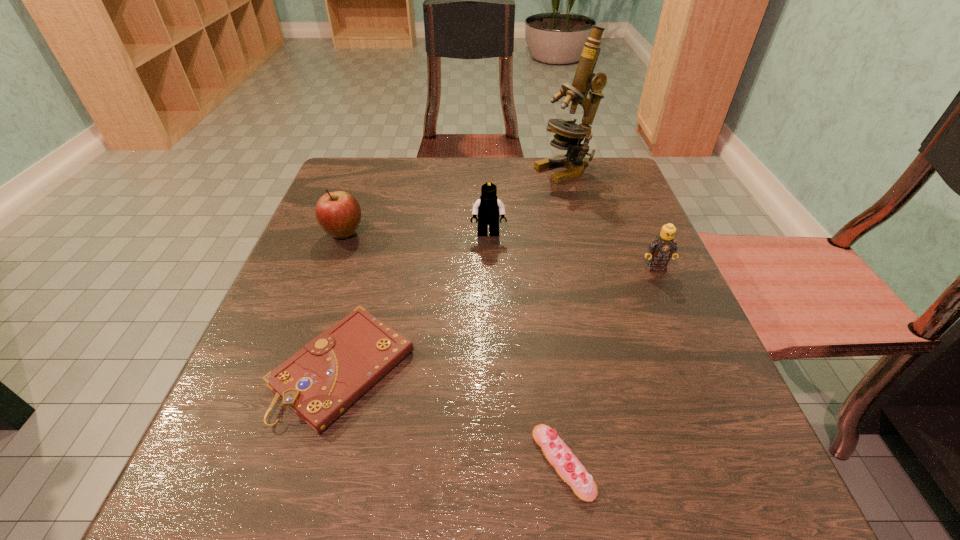
Locate an element on the screen. This screenshot has height=540, width=960. free point between the apple and the third nearest object is located at coordinates (500, 251).

I want to click on unoccupied area between the third object from left to right and the eclair, so click(526, 348).

Identify the location of free spot between the tallest object and the nearer Lego. The image size is (960, 540). (611, 219).

The height and width of the screenshot is (540, 960). What are the coordinates of `vacant area that lies between the microscope and the notebook` in the screenshot? It's located at (454, 269).

I want to click on vacant space that is in between the farther Lego and the apple, so click(x=417, y=234).

The width and height of the screenshot is (960, 540). Identify the location of free space between the notebook and the eclair. (453, 415).

Find the location of a particular element. Image resolution: width=960 pixels, height=540 pixels. vacant space that's between the shorter Lego and the eclair is located at coordinates [x=610, y=365].

Where is `free space between the apple and the nearer Lego`? The height and width of the screenshot is (540, 960). free space between the apple and the nearer Lego is located at coordinates (500, 251).

Find the location of a particular element. This screenshot has height=540, width=960. free area in between the eclair and the apple is located at coordinates (454, 348).

In order to click on the second closest object relative to the nearer Lego in this screenshot , I will do `click(569, 135)`.